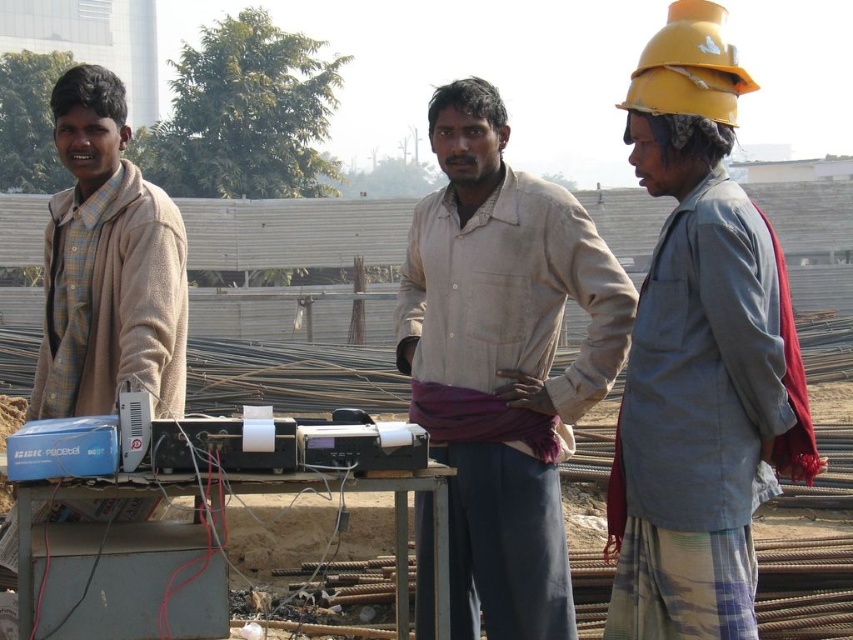
Does checkered fabric shirt at left appear under yellow matte hard hat at upper right?

Yes.

Which is more to the right, checkered fabric shirt at left or yellow matte hard hat at upper right?

yellow matte hard hat at upper right is more to the right.

Locate an element on the screen. The width and height of the screenshot is (853, 640). checkered fabric shirt at left is located at coordinates (107, 264).

Identify the location of checkered fabric shirt at left. The height and width of the screenshot is (640, 853). (107, 264).

Can you confirm if light brown fabric shirt at center is taller than yellow matte hard hat at upper right?

No, light brown fabric shirt at center is not taller than yellow matte hard hat at upper right.

Between light brown fabric shirt at center and yellow matte hard hat at upper right, which one appears on the right side from the viewer's perspective?

Positioned to the right is yellow matte hard hat at upper right.

Is point (495, 496) positioned in front of point (709, 88)?

No.

Where is `light brown fabric shirt at center`? This screenshot has width=853, height=640. light brown fabric shirt at center is located at coordinates (502, 362).

Who is lower down, gray fabric shirt at right or yellow matte hard hat at upper right?

Positioned lower is gray fabric shirt at right.

Is point (720, 273) closer to viewer compared to point (695, 29)?

Yes, point (720, 273) is closer to viewer.

Identify the location of gray fabric shirt at right. Image resolution: width=853 pixels, height=640 pixels. (699, 356).